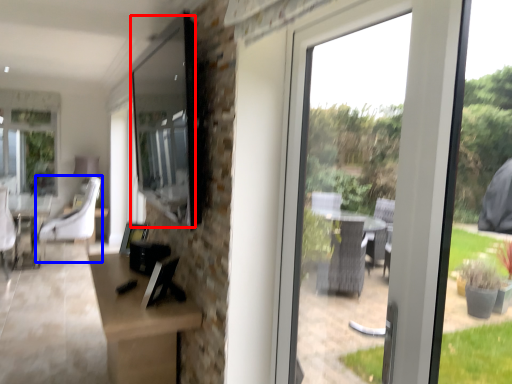
Question: Which of the following is the closest to the observer, window screen (highlighted by a red box) or chair (highlighted by a blue box)?

Choices:
 (A) window screen
 (B) chair

Answer: (A)